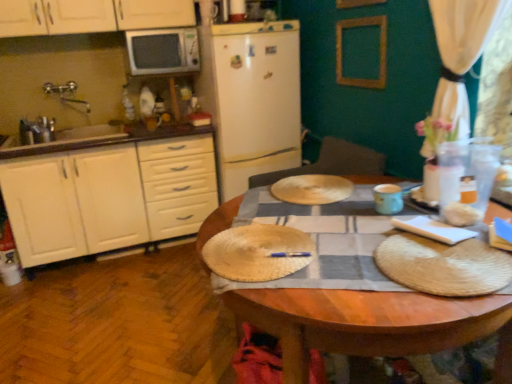
In order to click on matte blue cup at center right in this screenshot , I will do `click(388, 199)`.

This screenshot has height=384, width=512. What do you see at coordinates (388, 199) in the screenshot? I see `matte blue cup at center right` at bounding box center [388, 199].

Identify the location of wooden table at center. The height and width of the screenshot is (384, 512). (372, 323).

What is the approximate width of wooden frame at upper center?

It is 1.62 inches.

Measure the distance between wooden frame at upper center and camera.

They are 7.15 feet apart.

Where is `white matte refrigerator at center`? The width and height of the screenshot is (512, 384). white matte refrigerator at center is located at coordinates (251, 98).

At what (x,y) coordinates should I click in order to perform the action: click on white matte microwave at upper left. Please return your answer as a coordinate pair (x, y). This screenshot has height=384, width=512. Looking at the image, I should click on tap(163, 51).

Is bamboo placemat at center outside of wooden table at center?

No, bamboo placemat at center is inside or overlapping with wooden table at center.

Based on the photo, from the image's perspective, is bamboo placemat at center above or below wooden table at center?

From the image's perspective, bamboo placemat at center appears above wooden table at center.

Is bamboo placemat at center facing towards wooden table at center?

Yes, bamboo placemat at center is facing wooden table at center.

In the scene shown: How distant is bamboo placemat at center from wooden table at center?

bamboo placemat at center is 7.71 inches away from wooden table at center.

Consider the image. Considering the sizes of objects bamboo placemat at center and white matte refrigerator at center in the image provided, who is taller, bamboo placemat at center or white matte refrigerator at center?

With more height is white matte refrigerator at center.

Considering the relative positions of bamboo placemat at center and white matte refrigerator at center in the image provided, is bamboo placemat at center to the left of white matte refrigerator at center from the viewer's perspective?

In fact, bamboo placemat at center is to the right of white matte refrigerator at center.

From the image's perspective, between bamboo placemat at center and white matte refrigerator at center, who is located below?

bamboo placemat at center is shown below in the image.

Could you tell me if bamboo placemat at center is turned towards white matte refrigerator at center?

No, bamboo placemat at center is not facing towards white matte refrigerator at center.

From the image's perspective, between white matte refrigerator at center and white matte microwave at upper left, who is located below?

white matte refrigerator at center, from the image's perspective.

Is white matte refrigerator at center positioned beyond the bounds of white matte microwave at upper left?

white matte refrigerator at center lies outside white matte microwave at upper left's area.

Considering the sizes of objects white matte refrigerator at center and white matte microwave at upper left in the image provided, who is thinner, white matte refrigerator at center or white matte microwave at upper left?

Thinner between the two is white matte microwave at upper left.

Identify the location of table that appears in front of the white matte refrigerator at center. The height and width of the screenshot is (384, 512). (372, 323).

Is point (484, 323) more distant than point (226, 61)?

That is False.

From the image's perspective, which object appears higher, wooden table at center or white matte refrigerator at center?

white matte refrigerator at center.

Which is behind, wooden table at center or white matte refrigerator at center?

white matte refrigerator at center is behind.

Is bamboo placemat at center looking in the opposite direction of wooden frame at upper center?

No, bamboo placemat at center's orientation is not away from wooden frame at upper center.

The image size is (512, 384). In order to click on paper plate on the left of wooden frame at upper center in this screenshot , I will do `click(257, 252)`.

Considering the sizes of bamboo placemat at center and wooden frame at upper center in the image, is bamboo placemat at center wider or thinner than wooden frame at upper center?

bamboo placemat at center is wider than wooden frame at upper center.

Can you tell me how much white matte cabinet at left and matte blue cup at center right differ in facing direction?

The angle between the facing direction of white matte cabinet at left and the facing direction of matte blue cup at center right is 67.1 degrees.

Does white matte cabinet at left appear on the right side of matte blue cup at center right?

No.

Considering the relative sizes of white matte cabinet at left and matte blue cup at center right in the image provided, is white matte cabinet at left shorter than matte blue cup at center right?

No.

Considering the relative sizes of white matte cabinet at left and matte blue cup at center right in the image provided, is white matte cabinet at left wider than matte blue cup at center right?

Yes.

Which point is more forward, (277, 268) or (376, 195)?

Point (277, 268)

In the scene shown: From a real-world perspective, does bamboo placemat at center sit lower than matte blue cup at center right?

Indeed, from a real-world perspective, bamboo placemat at center is positioned beneath matte blue cup at center right.

Is matte blue cup at center right inside bamboo placemat at center?

No, matte blue cup at center right is not a part of bamboo placemat at center.

Which object is positioned more to the right, bamboo placemat at center or matte blue cup at center right?

Positioned to the right is matte blue cup at center right.

At what (x,y) coordinates should I click in order to perform the action: click on table to the right of bamboo placemat at center. Please return your answer as a coordinate pair (x, y). The width and height of the screenshot is (512, 384). Looking at the image, I should click on (372, 323).

The height and width of the screenshot is (384, 512). What are the coordinates of `refrigerator behind the bamboo placemat at center` in the screenshot? It's located at (251, 98).

Based on their spatial positions, is matte blue cup at center right or wooden table at center closer to white matte refrigerator at center?

matte blue cup at center right lies closer to white matte refrigerator at center than the other object.

From the image, which object appears to be farther from white matte refrigerator at center, bamboo placemat at center or white matte microwave at upper left?

bamboo placemat at center lies further to white matte refrigerator at center than the other object.

Looking at the image, which one is located closer to bamboo placemat at center, white matte microwave at upper left or white matte refrigerator at center?

Based on the image, white matte refrigerator at center appears to be nearer to bamboo placemat at center.

Estimate the real-world distances between objects in this image. Which object is further from wooden frame at upper center, bamboo placemat at center or white fabric curtain at upper right?

bamboo placemat at center.

Estimate the real-world distances between objects in this image. Which object is closer to wooden frame at upper center, white fabric curtain at upper right or white matte cabinet at left?

white fabric curtain at upper right is closer to wooden frame at upper center.

Considering their positions, is white matte cabinet at left positioned closer to white matte refrigerator at center than white matte microwave at upper left?

white matte microwave at upper left.

Based on their spatial positions, is bamboo placemat at center or wooden table at center further from white matte microwave at upper left?

wooden table at center.

Estimate the real-world distances between objects in this image. Which object is further from wooden table at center, matte blue cup at center right or bamboo placemat at center?

The object further to wooden table at center is matte blue cup at center right.

Where is `table between white matte cabinet at left and white fabric curtain at upper right`? The width and height of the screenshot is (512, 384). table between white matte cabinet at left and white fabric curtain at upper right is located at coordinates (372, 323).

Locate an element on the screen. The height and width of the screenshot is (384, 512). refrigerator between bamboo placemat at center and white matte microwave at upper left in the front-back direction is located at coordinates (251, 98).

I want to click on paper plate positioned between wooden table at center and white matte microwave at upper left from near to far, so click(x=257, y=252).

Where is `picture frame between wooden table at center and white matte refrigerator at center along the z-axis`? picture frame between wooden table at center and white matte refrigerator at center along the z-axis is located at coordinates (379, 52).